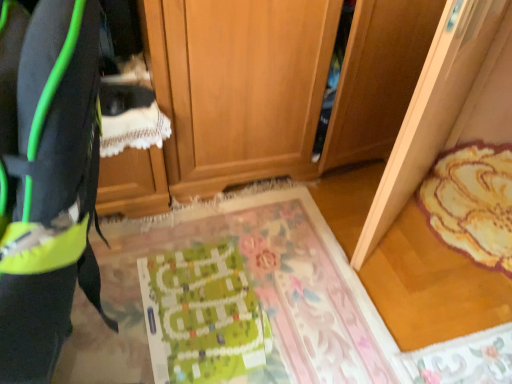
Find the location of `free spot to the right of green paper at center`. free spot to the right of green paper at center is located at coordinates (311, 308).